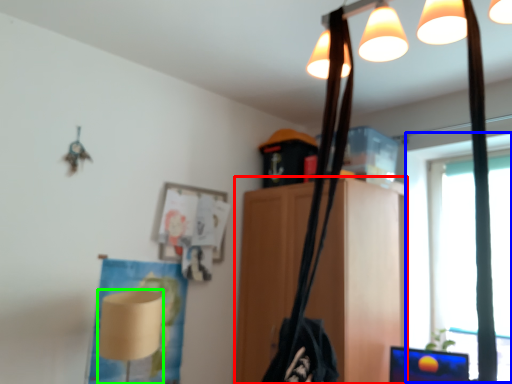
Question: Which object is positioned farthest from furniture (highlighted by a red box)? Select from window screen (highlighted by a blue box) and lamp (highlighted by a green box).

Choices:
 (A) window screen
 (B) lamp

Answer: (B)